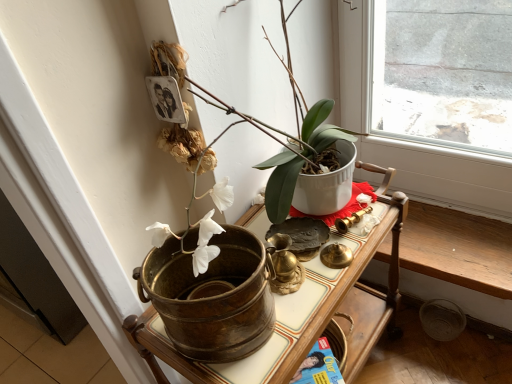
In order to face brass textured bucket at center, should I rotate leftwards or rightwards?

Rotate your view right by about 5.863°.

Locate an element on the screen. The width and height of the screenshot is (512, 384). brass textured bucket at center is located at coordinates (301, 311).

Image resolution: width=512 pixels, height=384 pixels. Describe the element at coordinates (301, 311) in the screenshot. I see `brass textured bucket at center` at that location.

At what (x,y) coordinates should I click in order to perform the action: click on white glossy pot at upper center. Please return your answer as a coordinate pair (x, y). Looking at the image, I should click on (210, 289).

Image resolution: width=512 pixels, height=384 pixels. What do you see at coordinates (210, 289) in the screenshot?
I see `white glossy pot at upper center` at bounding box center [210, 289].

Image resolution: width=512 pixels, height=384 pixels. Identify the location of brass textured bucket at center. tap(301, 311).

Is brass textured bucket at center to the right of white glossy pot at upper center from the viewer's perspective?

Indeed, brass textured bucket at center is positioned on the right side of white glossy pot at upper center.

Which object is further away from the camera taking this photo, brass textured bucket at center or white glossy pot at upper center?

brass textured bucket at center is further from the camera.

Considering the positions of points (372, 235) and (172, 327), is point (372, 235) closer to camera compared to point (172, 327)?

That is False.

From the image's perspective, is brass textured bucket at center on white glossy pot at upper center?

Incorrect, from the image's perspective, brass textured bucket at center is lower than white glossy pot at upper center.

From a real-world perspective, is brass textured bucket at center under white glossy pot at upper center?

Indeed, from a real-world perspective, brass textured bucket at center is positioned beneath white glossy pot at upper center.

Is brass textured bucket at center wider than white glossy pot at upper center?

Indeed, brass textured bucket at center has a greater width compared to white glossy pot at upper center.

Considering the relative sizes of brass textured bucket at center and white glossy pot at upper center in the image provided, is brass textured bucket at center shorter than white glossy pot at upper center?

Incorrect, the height of brass textured bucket at center does not fall short of that of white glossy pot at upper center.

Can you confirm if brass textured bucket at center is bigger than white glossy pot at upper center?

Indeed, brass textured bucket at center has a larger size compared to white glossy pot at upper center.

Can we say brass textured bucket at center lies outside white glossy pot at upper center?

Absolutely, brass textured bucket at center is external to white glossy pot at upper center.

Is brass textured bucket at center next to white glossy pot at upper center and touching it?

No, brass textured bucket at center is not in contact with white glossy pot at upper center.

Consider the image. Is brass textured bucket at center looking in the opposite direction of white glossy pot at upper center?

brass textured bucket at center is not turned away from white glossy pot at upper center.

Looking at this image, what's the angular difference between brass textured bucket at center and white glossy pot at upper center's facing directions?

The angular difference between brass textured bucket at center and white glossy pot at upper center is 3.77 degrees.

Image resolution: width=512 pixels, height=384 pixels. In order to click on table directly beneath the white glossy pot at upper center (from a real-world perspective) in this screenshot , I will do pos(301,311).

Is white glossy pot at upper center to the left of brass textured bucket at center from the viewer's perspective?

Correct, you'll find white glossy pot at upper center to the left of brass textured bucket at center.

Is white glossy pot at upper center positioned behind brass textured bucket at center?

No, it is not.

Between point (203, 244) and point (397, 264), which one is positioned behind?

The point (397, 264) is more distant.

From the image's perspective, which is above, white glossy pot at upper center or brass textured bucket at center?

white glossy pot at upper center appears higher in the image.

From a real-world perspective, which object stands above the other?

white glossy pot at upper center.

Based on the photo, considering the sizes of white glossy pot at upper center and brass textured bucket at center in the image, is white glossy pot at upper center wider or thinner than brass textured bucket at center?

Considering their sizes, white glossy pot at upper center looks slimmer than brass textured bucket at center.

Between white glossy pot at upper center and brass textured bucket at center, which one has less height?

white glossy pot at upper center.

Between white glossy pot at upper center and brass textured bucket at center, which one has larger size?

brass textured bucket at center.

Would you say white glossy pot at upper center is inside or outside brass textured bucket at center?

white glossy pot at upper center cannot be found inside brass textured bucket at center.

Is white glossy pot at upper center not close to brass textured bucket at center?

No, white glossy pot at upper center is in close proximity to brass textured bucket at center.

Is brass textured bucket at center at the back of white glossy pot at upper center?

That's not correct — white glossy pot at upper center is not looking away from brass textured bucket at center.

Identify the location of table below the white glossy pot at upper center (from the image's perspective). This screenshot has height=384, width=512. (301, 311).

Locate an element on the screen. houseplant above the brass textured bucket at center (from the image's perspective) is located at coordinates (210, 289).

You are a GUI agent. You are given a task and a screenshot of the screen. Output one action in this format:
    pyautogui.click(x=<x>, y=<y>)
    Task: Click on the table below the white glossy pot at upper center (from a real-world perspective)
    The width and height of the screenshot is (512, 384).
    Given the screenshot: What is the action you would take?
    pyautogui.click(x=301, y=311)